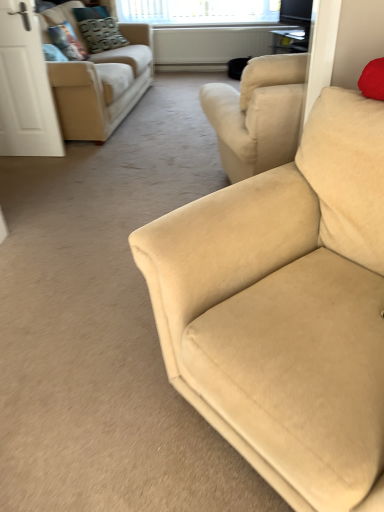
Question: Considering the positions of white matte door at left and beige fabric couch at upper left, acting as the second studio couch starting from the front, in the image, is white matte door at left taller or shorter than beige fabric couch at upper left, acting as the second studio couch starting from the front,?

Choices:
 (A) short
 (B) tall

Answer: (B)

Question: Is white matte door at left bigger or smaller than beige fabric couch at upper left, the 1th studio couch from the back?

Choices:
 (A) big
 (B) small

Answer: (B)

Question: Which of these objects is positioned closest to the clear glass window at upper center?

Choices:
 (A) velvet textured pillow at upper left, the 2th pillow from the front
 (B) beige fabric couch at upper left, the 1th studio couch viewed from the top
 (C) beige fabric couch at right, the first studio couch in the right-to-left sequence
 (D) white matte door at left
 (E) velvet textured pillow at upper left, positioned as the 1th pillow in front-to-back order

Answer: (A)

Question: Which object is positioned farthest from the velvet textured pillow at upper left, positioned as the 1th pillow in front-to-back order?

Choices:
 (A) white matte door at left
 (B) clear glass window at upper center
 (C) velvet textured pillow at upper left, the first pillow positioned from the back
 (D) beige fabric couch at upper left, the 1th studio couch from the back
 (E) beige fabric couch at right, the second studio couch viewed from the left

Answer: (E)